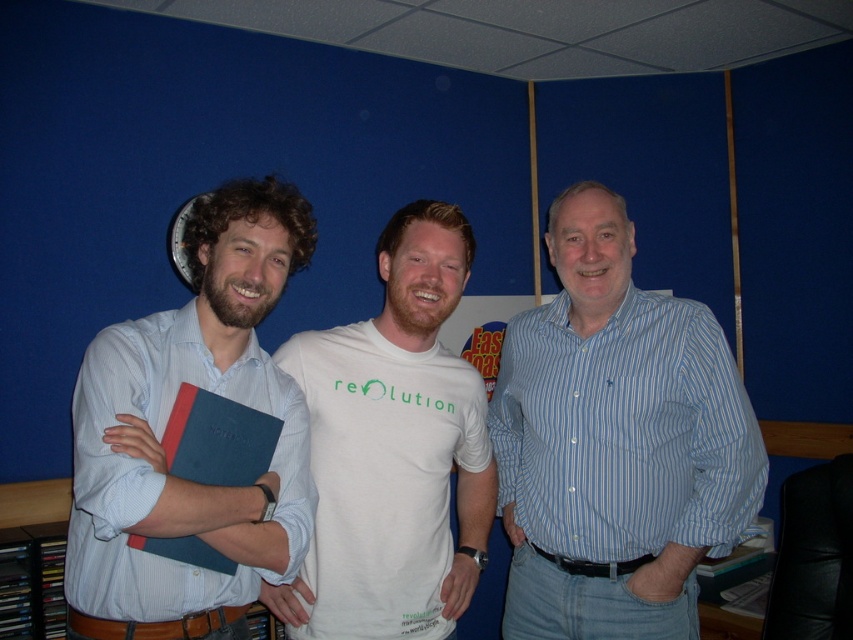
Question: Which point is closer to the camera?

Choices:
 (A) matte blue book at center
 (B) white cotton t-shirt at center

Answer: (A)

Question: Does matte blue book at center lie behind blue matte folder at center?

Choices:
 (A) no
 (B) yes

Answer: (A)

Question: Which point is farther to the camera?

Choices:
 (A) matte blue book at center
 (B) white cotton t-shirt at center

Answer: (B)

Question: Does matte blue book at center appear over white cotton t-shirt at center?

Choices:
 (A) no
 (B) yes

Answer: (B)

Question: Which object is the farthest from the white cotton t-shirt at center?

Choices:
 (A) blue striped shirt at center
 (B) blue matte folder at center

Answer: (B)

Question: Does matte blue book at center lie in front of blue matte folder at center?

Choices:
 (A) yes
 (B) no

Answer: (A)